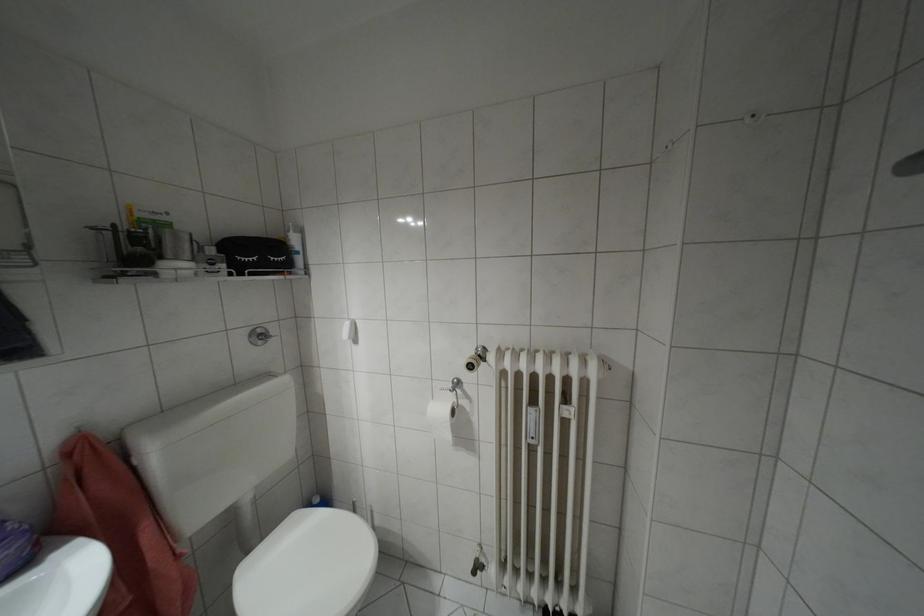
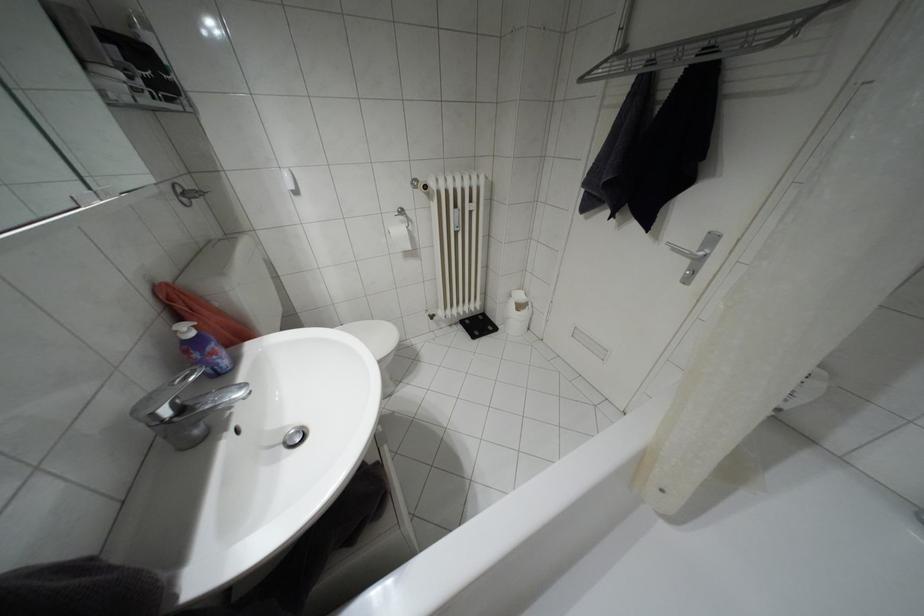
The first image is from the beginning of the video and the second image is from the end. How did the camera likely rotate when shooting the video?

The rotation direction of the camera is right-down.